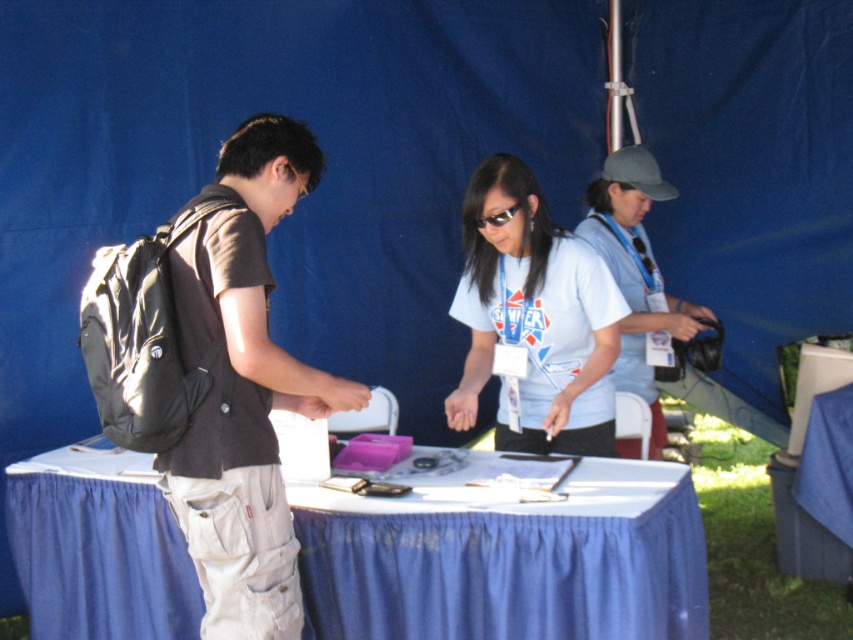
You are a person who wants to place a 18 inch long object between the blue fabric table at center and the dark gray backpack at center. Is there enough space for the object to fit without overlapping either item?

The distance between the blue fabric table at center and the dark gray backpack at center is 19.62 inches. Since the object is 18 inches long, there is enough space to place it between them without overlapping either item.

You are standing at the registration booth and see the dark gray backpack at center and the white matte shirt at center. Which object is positioned lower from the ground?

The dark gray backpack at center is below the white matte shirt at center, so the dark gray backpack at center is positioned lower from the ground.